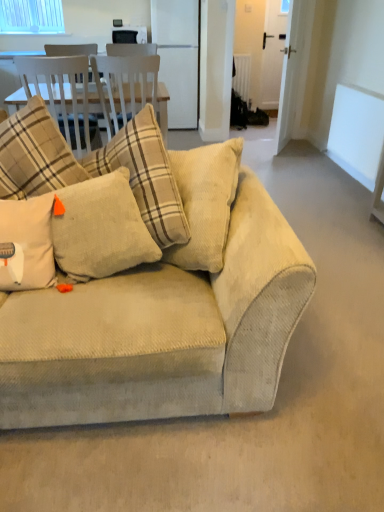
Question: From the image's perspective, would you say beige corduroy pillow at center, which is counted as the second pillow, starting from the right, is positioned over beige corduroy couch at center?

Choices:
 (A) yes
 (B) no

Answer: (A)

Question: Can you confirm if beige corduroy pillow at center, which is counted as the second pillow, starting from the right, is positioned to the right of beige corduroy couch at center?

Choices:
 (A) yes
 (B) no

Answer: (B)

Question: Would you say beige corduroy couch at center is part of beige corduroy pillow at center, the first pillow positioned from the left,'s contents?

Choices:
 (A) no
 (B) yes

Answer: (A)

Question: Can you confirm if beige corduroy pillow at center, the first pillow positioned from the left, is thinner than beige corduroy couch at center?

Choices:
 (A) yes
 (B) no

Answer: (B)

Question: Could you tell me if beige corduroy pillow at center, which is counted as the second pillow, starting from the right, is facing beige corduroy couch at center?

Choices:
 (A) no
 (B) yes

Answer: (A)

Question: In terms of height, does white matte window screen at upper right look taller or shorter compared to white glossy refrigerator at center?

Choices:
 (A) tall
 (B) short

Answer: (B)

Question: From a real-world perspective, is white matte window screen at upper right physically located above or below white glossy refrigerator at center?

Choices:
 (A) above
 (B) below

Answer: (B)

Question: Is white matte window screen at upper right inside or outside of white glossy refrigerator at center?

Choices:
 (A) outside
 (B) inside

Answer: (A)

Question: Considering the positions of white matte window screen at upper right and white glossy refrigerator at center in the image, is white matte window screen at upper right wider or thinner than white glossy refrigerator at center?

Choices:
 (A) thin
 (B) wide

Answer: (A)

Question: Considering the positions of beige corduroy couch at center and white matte window screen at upper right in the image, is beige corduroy couch at center bigger or smaller than white matte window screen at upper right?

Choices:
 (A) big
 (B) small

Answer: (A)

Question: Is beige corduroy couch at center inside or outside of white matte window screen at upper right?

Choices:
 (A) outside
 (B) inside

Answer: (A)

Question: In terms of width, does beige corduroy couch at center look wider or thinner when compared to white matte window screen at upper right?

Choices:
 (A) wide
 (B) thin

Answer: (A)

Question: In terms of height, does beige corduroy couch at center look taller or shorter compared to white matte window screen at upper right?

Choices:
 (A) tall
 (B) short

Answer: (A)

Question: In the image, is clear glass window at upper left on the left side or the right side of white glossy refrigerator at center?

Choices:
 (A) left
 (B) right

Answer: (A)

Question: In terms of height, does clear glass window at upper left look taller or shorter compared to white glossy refrigerator at center?

Choices:
 (A) short
 (B) tall

Answer: (A)